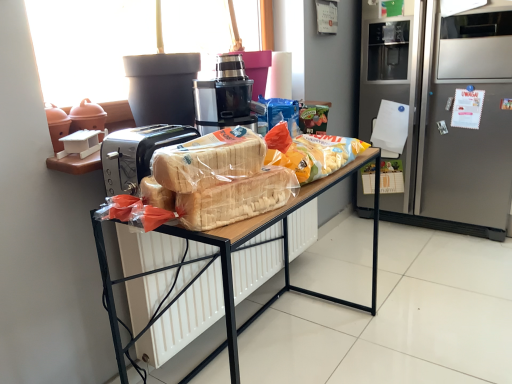
Question: Do you think satin silver refrigerator at right is within translucent plastic bag of chips at center, which appears as the 3th snack when viewed from the front, or outside of it?

Choices:
 (A) outside
 (B) inside

Answer: (A)

Question: Considering the positions of satin silver refrigerator at right and translucent plastic bag of chips at center, which is counted as the 1th snack, starting from the back, in the image, is satin silver refrigerator at right bigger or smaller than translucent plastic bag of chips at center, which is counted as the 1th snack, starting from the back,?

Choices:
 (A) small
 (B) big

Answer: (B)

Question: Considering the real-world distances, which object is closest to the translucent plastic bread at center, positioned as the third snack in back-to-front order?

Choices:
 (A) translucent plastic bag of chips at center, which is counted as the 1th snack, starting from the back
 (B) wooden desk at center
 (C) translucent plastic bread at center, which is the second snack from front to back
 (D) black plastic juicer at center
 (E) satin silver refrigerator at right

Answer: (C)

Question: Estimate the real-world distances between objects in this image. Which object is closer to the translucent plastic bread at center, which is the second snack from front to back?

Choices:
 (A) satin silver refrigerator at right
 (B) wooden desk at center
 (C) translucent plastic bread at center, the 1th snack viewed from the front
 (D) black plastic juicer at center
 (E) translucent plastic bag of chips at center, which is counted as the 1th snack, starting from the back

Answer: (C)